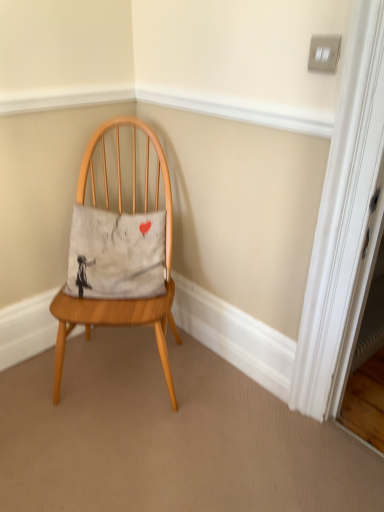
Question: Looking at the image, does white cotton pillow at center seem bigger or smaller compared to wooden chair at center?

Choices:
 (A) small
 (B) big

Answer: (A)

Question: Is point (127, 224) positioned closer to the camera than point (163, 313)?

Choices:
 (A) closer
 (B) farther

Answer: (B)

Question: Considering the positions of white cotton pillow at center and wooden chair at center in the image, is white cotton pillow at center wider or thinner than wooden chair at center?

Choices:
 (A) thin
 (B) wide

Answer: (A)

Question: From the image's perspective, is wooden chair at center above or below white cotton pillow at center?

Choices:
 (A) below
 (B) above

Answer: (A)

Question: Looking at the image, does wooden chair at center seem bigger or smaller compared to white cotton pillow at center?

Choices:
 (A) small
 (B) big

Answer: (B)

Question: Is wooden chair at center to the left or to the right of white cotton pillow at center in the image?

Choices:
 (A) left
 (B) right

Answer: (B)

Question: Is wooden chair at center taller or shorter than white cotton pillow at center?

Choices:
 (A) tall
 (B) short

Answer: (A)